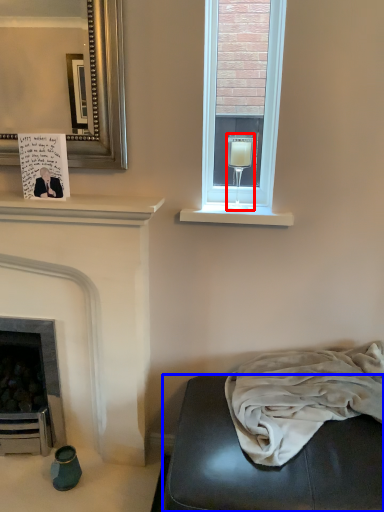
Question: Which object appears farthest to the camera in this image, wine glass (highlighted by a red box) or studio couch (highlighted by a blue box)?

Choices:
 (A) wine glass
 (B) studio couch

Answer: (A)